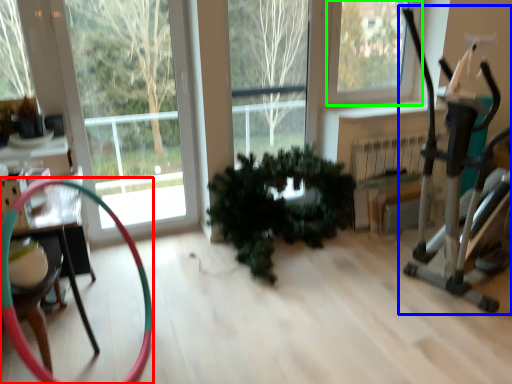
Question: Based on their relative distances, which object is farther from garden hose (highlighted by a red box)? Choose from baby carriage (highlighted by a blue box) and window (highlighted by a green box).

Choices:
 (A) baby carriage
 (B) window

Answer: (B)